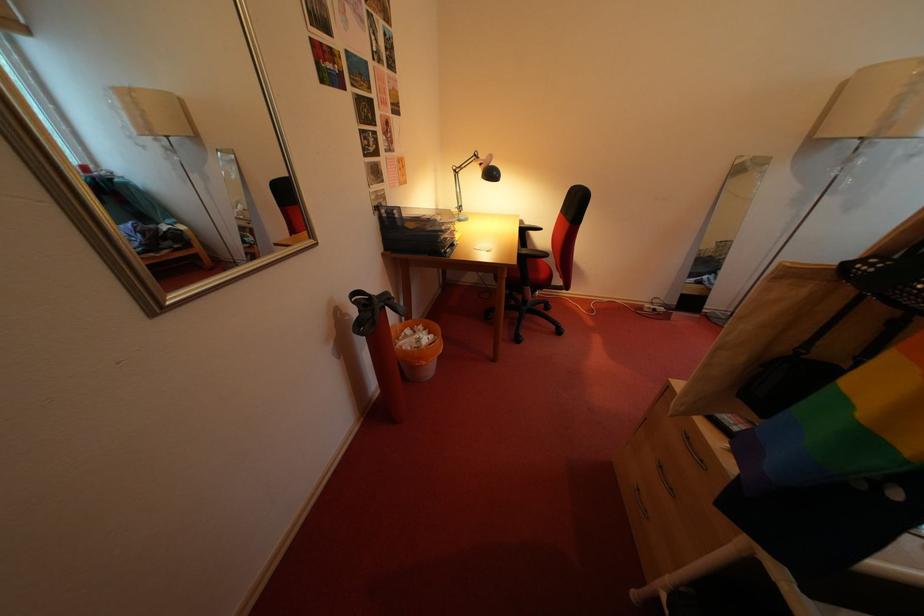
Image resolution: width=924 pixels, height=616 pixels. What do you see at coordinates (489, 172) in the screenshot? I see `the black lamp head` at bounding box center [489, 172].